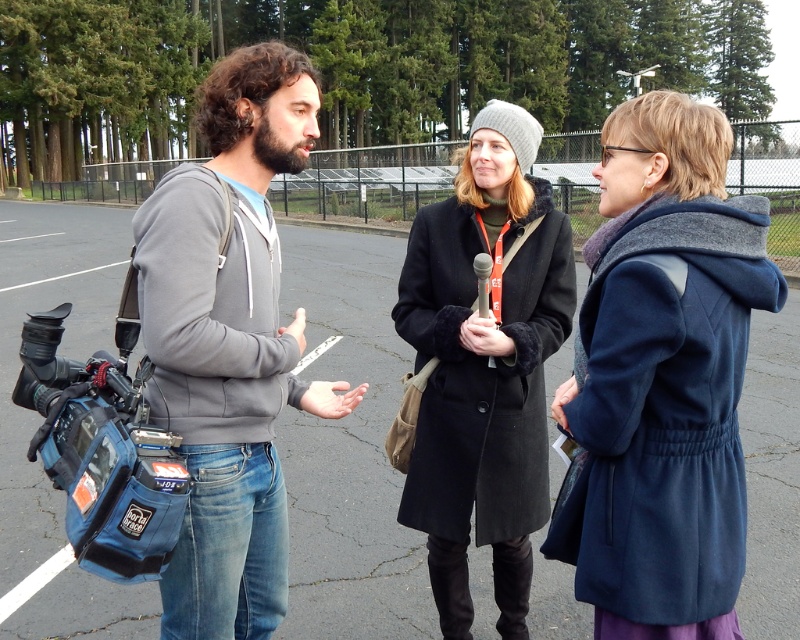
Question: Does navy wool coat at center lie behind gray hoodie at center?

Choices:
 (A) no
 (B) yes

Answer: (A)

Question: Which point appears farthest from the camera in this image?

Choices:
 (A) (116, 237)
 (B) (670, 380)
 (C) (546, 205)
 (D) (234, 378)

Answer: (A)

Question: Is navy wool coat at center smaller than gray hoodie at center?

Choices:
 (A) no
 (B) yes

Answer: (B)

Question: Which object is the closest to the gray hoodie at center?

Choices:
 (A) blue fabric video camera at left
 (B) asphalt pavement at center
 (C) black wool coat at center

Answer: (A)

Question: Which point is farther to the camera?

Choices:
 (A) (498, 552)
 (B) (362, 300)
 (C) (704, 632)
 (D) (344, 381)

Answer: (B)

Question: Can you confirm if gray hoodie at center is thinner than black wool coat at center?

Choices:
 (A) no
 (B) yes

Answer: (A)